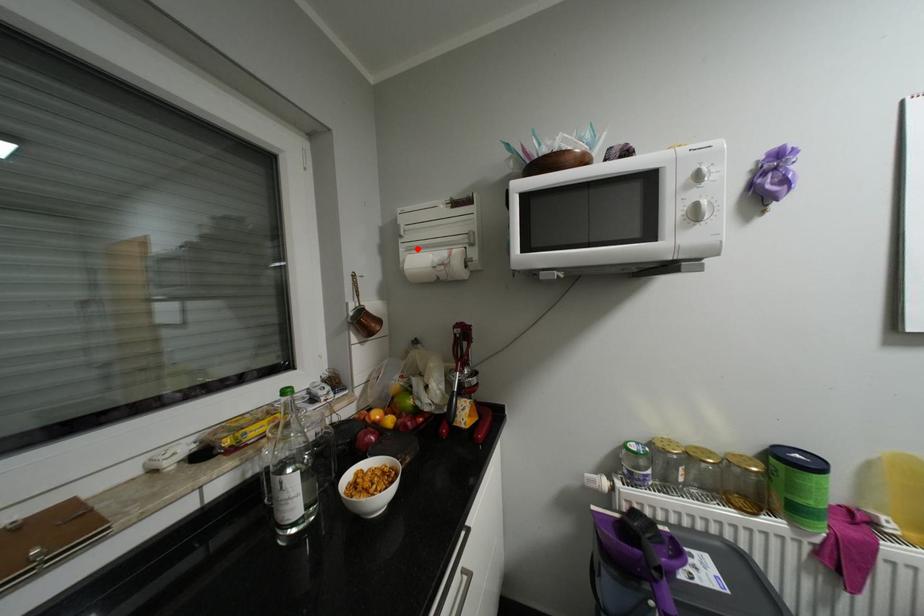
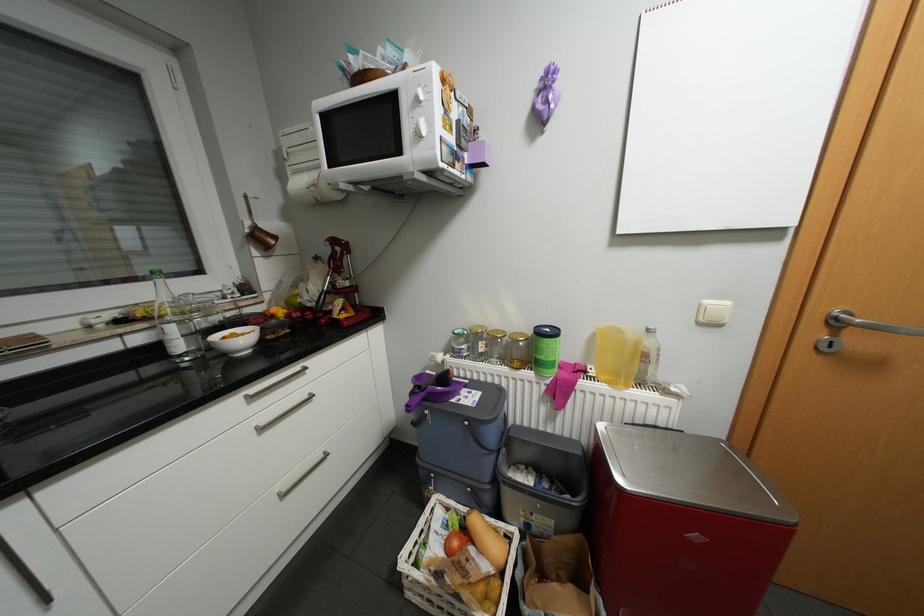
In the second image, find the point that corresponds to the highlighted location in the first image.

(302, 172)